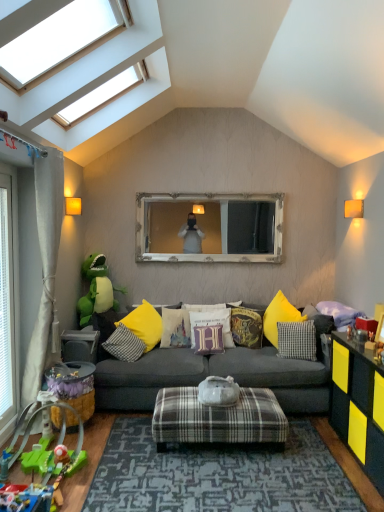
Question: Considering the positions of transparent glass skylight at upper left and green plastic toy at lower left, placed as the second toy when sorted from front to back, in the image, is transparent glass skylight at upper left wider or thinner than green plastic toy at lower left, placed as the second toy when sorted from front to back,?

Choices:
 (A) wide
 (B) thin

Answer: (A)

Question: Considering the positions of transparent glass skylight at upper left and green plastic toy at lower left, which is the 1th toy in bottom-to-top order, in the image, is transparent glass skylight at upper left taller or shorter than green plastic toy at lower left, which is the 1th toy in bottom-to-top order,?

Choices:
 (A) short
 (B) tall

Answer: (B)

Question: Estimate the real-world distances between objects in this image. Which object is farther from the yellow fabric pillow at center, which is counted as the 6th pillow, starting from the right?

Choices:
 (A) checkered fabric pillow at center, which appears as the 1th pillow when viewed from the right
 (B) plastic toy car at lower left, the 1th toy positioned from the front
 (C) plaid fabric ottoman at center
 (D) transparent glass door at left
 (E) purple velvet pillow at center, the 3th pillow from the left

Answer: (B)

Question: Which object is the farthest from the green plush toy at left, placed as the first toy when sorted from back to front?

Choices:
 (A) matte black dresser at right
 (B) plaid fabric ottoman at center
 (C) matte gray table at lower left
 (D) dark gray fabric couch at center
 (E) plastic toy car at lower left, the 1th toy positioned from the front

Answer: (A)